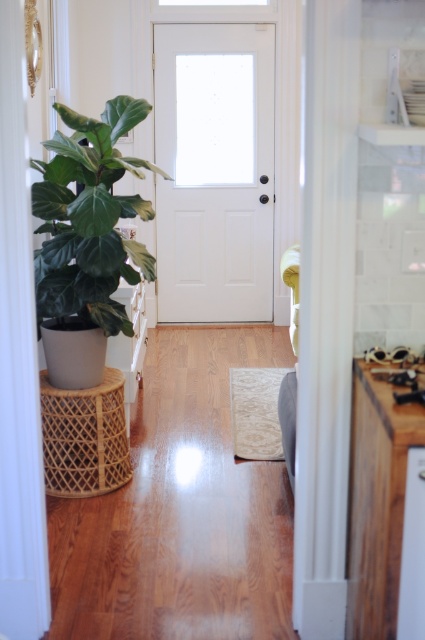
Between point (96, 248) and point (71, 449), which one is positioned behind?

The point (71, 449) is behind.

Does green matte plant at left appear under rattan stool at left?

Incorrect, green matte plant at left is not positioned below rattan stool at left.

Who is more distant from viewer, (36, 212) or (115, 412)?

The point (115, 412) is more distant.

Identify the location of green matte plant at left. The height and width of the screenshot is (640, 425). (90, 218).

Which is in front, point (351, 433) or point (82, 394)?

Point (351, 433)

The height and width of the screenshot is (640, 425). In order to click on wooden countertop at right in this screenshot , I will do `click(376, 502)`.

Is white matte door at center below wooden countertop at right?

No.

Does white matte door at center have a lesser height compared to wooden countertop at right?

No.

Who is more distant from viewer, (212, 44) or (387, 502)?

The point (212, 44) is behind.

Where is `white matte door at center`? white matte door at center is located at coordinates (214, 170).